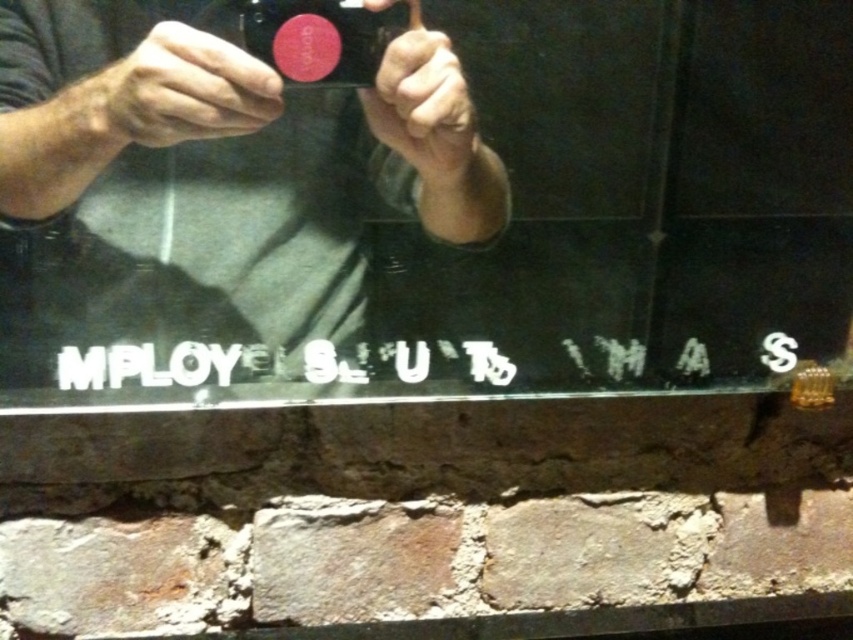
From the picture: Can you confirm if gray matte shirt at center is thinner than matte black camera at center?

In fact, gray matte shirt at center might be wider than matte black camera at center.

Does gray matte shirt at center lie behind matte black camera at center?

No, gray matte shirt at center is in front of matte black camera at center.

Between point (151, 211) and point (332, 22), which one is positioned in front?

Point (332, 22) is in front.

Identify the location of gray matte shirt at center. (209, 179).